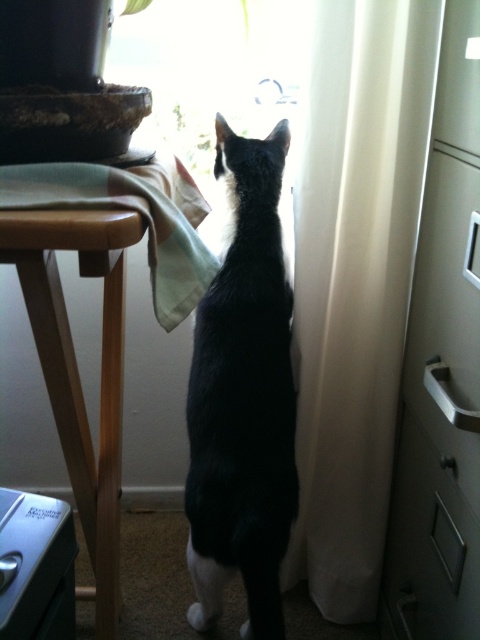
Question: Does wooden table at left come behind metallic silver file cabinet at lower left?

Choices:
 (A) yes
 (B) no

Answer: (B)

Question: Does white sheer curtain at right appear under wooden table at left?

Choices:
 (A) no
 (B) yes

Answer: (A)

Question: Which of these objects is positioned closest to the black fur cat at center?

Choices:
 (A) metallic gray drawer at lower right
 (B) light green cotton cloth at left
 (C) white sheer curtain at right
 (D) metallic silver file cabinet at lower left

Answer: (C)

Question: Which point is closer to the camera?

Choices:
 (A) white sheer curtain at right
 (B) light green cotton cloth at left
 (C) black fur cat at center
 (D) metallic silver file cabinet at lower left

Answer: (B)

Question: Does wooden table at left have a smaller size compared to metallic silver file cabinet at lower left?

Choices:
 (A) no
 (B) yes

Answer: (A)

Question: Which object is positioned closest to the metallic silver file cabinet at lower left?

Choices:
 (A) wooden table at left
 (B) metallic gray drawer at lower right
 (C) black fur cat at center

Answer: (A)